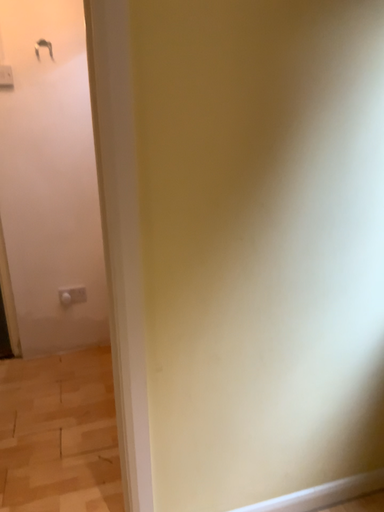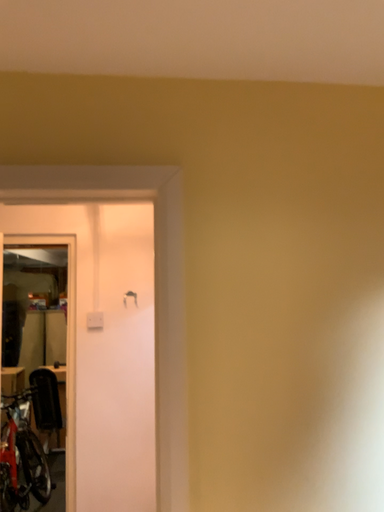
Question: Which way did the camera rotate in the video?

Choices:
 (A) rotated right
 (B) rotated left

Answer: (B)